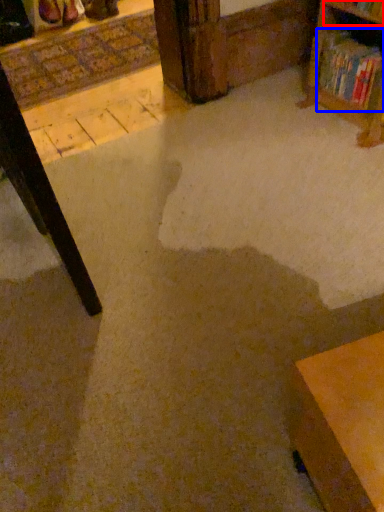
Question: Which point is further to the camera, shelf (highlighted by a red box) or book (highlighted by a blue box)?

Choices:
 (A) shelf
 (B) book

Answer: (B)